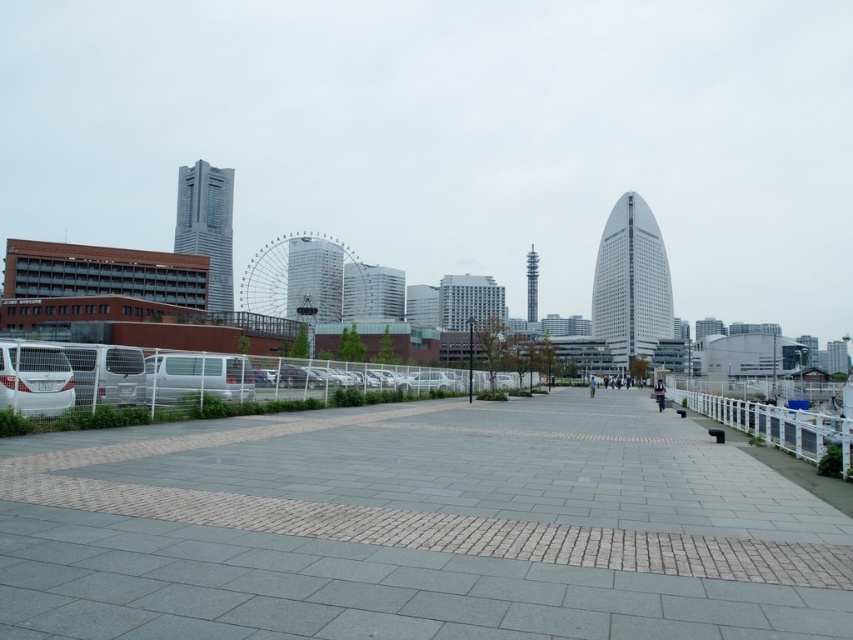
Question: Can you confirm if gray concrete pavement at center is positioned above white plastic rail at lower right?

Choices:
 (A) no
 (B) yes

Answer: (B)

Question: Is gray concrete pavement at center thinner than white plastic rail at lower right?

Choices:
 (A) no
 (B) yes

Answer: (A)

Question: Which point is farther to the camera?

Choices:
 (A) white plastic rail at lower right
 (B) gray concrete pavement at center

Answer: (A)

Question: Is gray concrete pavement at center thinner than white plastic rail at lower right?

Choices:
 (A) no
 (B) yes

Answer: (A)